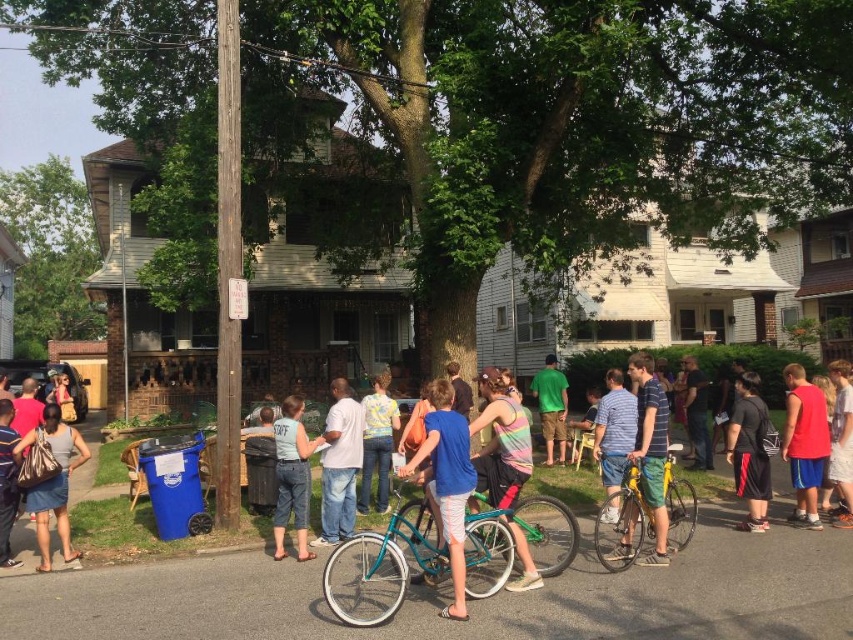
Question: Which object is closer to the camera taking this photo?

Choices:
 (A) yellow-green shorts at center
 (B) teal matte bicycle at center

Answer: (B)

Question: Can you confirm if matte gray tank top at lower left is smaller than red t-shirt at right?

Choices:
 (A) no
 (B) yes

Answer: (A)

Question: Is red cotton tank top at right wider than matte black shirt at lower left?

Choices:
 (A) no
 (B) yes

Answer: (B)

Question: Which object is farther from the camera taking this photo?

Choices:
 (A) rainbow striped shirt at center
 (B) yellow-green shorts at center
 (C) white cotton shirt at center

Answer: (C)

Question: Which object is farther from the camera taking this photo?

Choices:
 (A) denim shorts at center
 (B) red t-shirt at right

Answer: (B)

Question: Is striped cotton shirt at center positioned at the back of black cotton shirt at right?

Choices:
 (A) no
 (B) yes

Answer: (A)